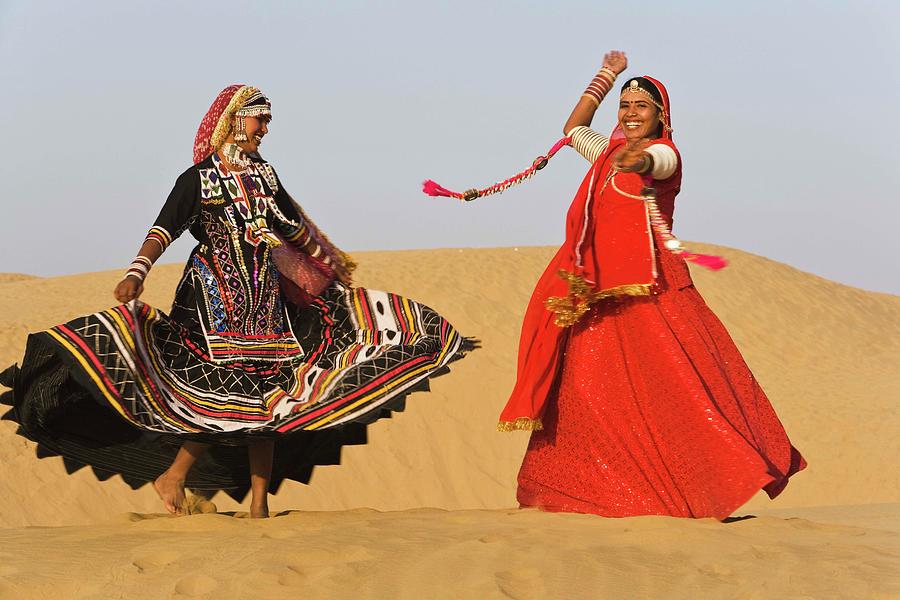
You are a GUI agent. You are given a task and a screenshot of the screen. Output one action in this format:
    pyautogui.click(x=<x>, y=<y>)
    Task: Click on the gold trim
    
    Given the screenshot: What is the action you would take?
    pyautogui.click(x=626, y=289)